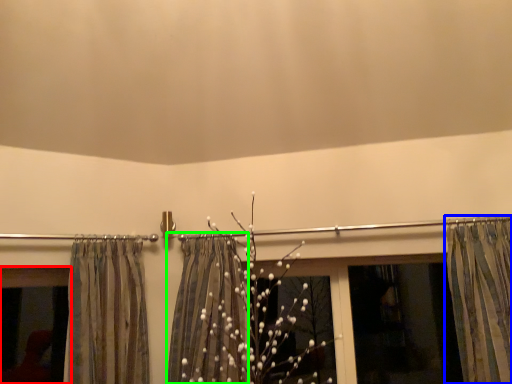
Question: Which object is positioned farthest from window (highlighted by a red box)? Select from curtain (highlighted by a blue box) and shower curtain (highlighted by a green box).

Choices:
 (A) curtain
 (B) shower curtain

Answer: (A)